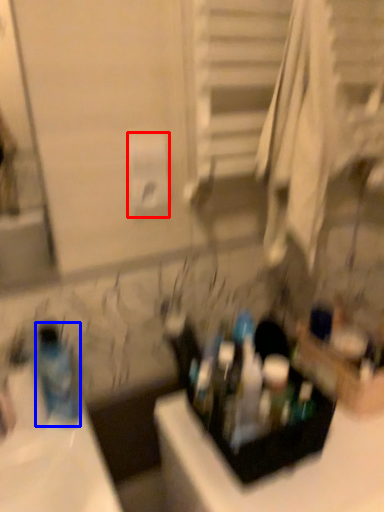
Question: Which object appears farthest to the camera in this image, toilet paper (highlighted by a red box) or bottle (highlighted by a blue box)?

Choices:
 (A) toilet paper
 (B) bottle

Answer: (A)